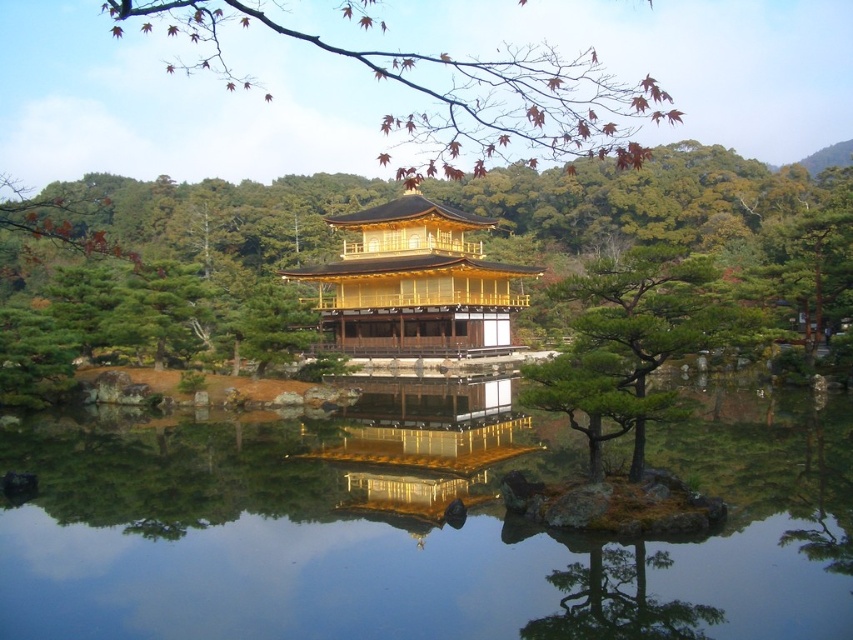
Is green textured pine tree at center above green textured tree at center?

Correct, green textured pine tree at center is located above green textured tree at center.

Does green textured pine tree at center have a smaller size compared to green textured tree at center?

No.

Who is more forward, (569,225) or (648,312)?

Point (648,312) is in front.

This screenshot has width=853, height=640. Find the location of `green textured pine tree at center`. green textured pine tree at center is located at coordinates (651, 204).

Does point (556, 221) come behind point (213, 22)?

No, (556, 221) is in front of (213, 22).

Who is taller, green textured pine tree at center or reddish-brown bark branch at upper center?

reddish-brown bark branch at upper center is taller.

Is point (555, 176) farther from camera compared to point (627, 88)?

That is False.

Where is `green textured pine tree at center`? The height and width of the screenshot is (640, 853). green textured pine tree at center is located at coordinates (651, 204).

Does transparent water at center appear on the right side of green textured pine tree at center?

Indeed, transparent water at center is positioned on the right side of green textured pine tree at center.

Looking at this image, which is more to the right, transparent water at center or green textured pine tree at center?

Positioned to the right is transparent water at center.

What do you see at coordinates (415, 538) in the screenshot? I see `transparent water at center` at bounding box center [415, 538].

The width and height of the screenshot is (853, 640). Identify the location of transparent water at center. (415, 538).